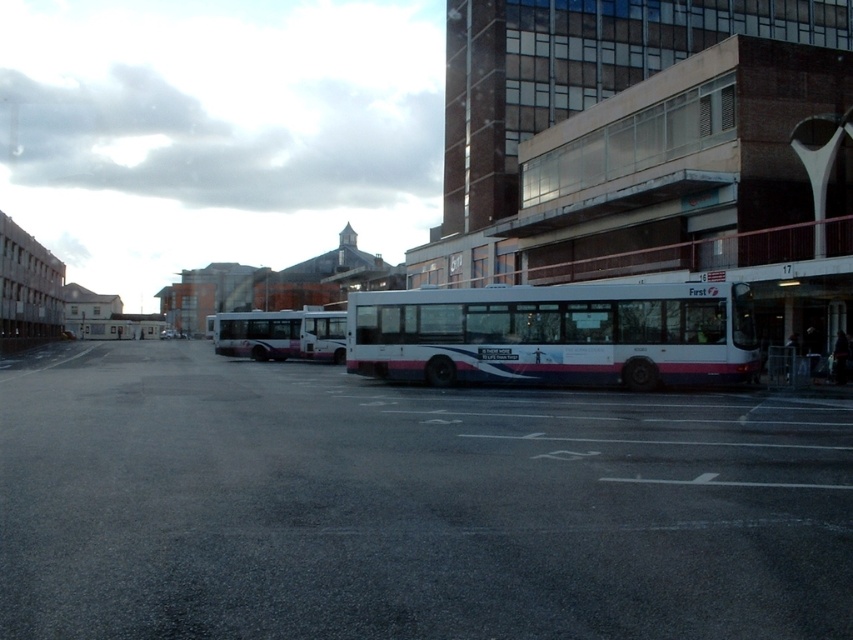
Question: Considering the relative positions of white matte bus at center and white glossy bus at center in the image provided, where is white matte bus at center located with respect to white glossy bus at center?

Choices:
 (A) left
 (B) right

Answer: (B)

Question: Is white matte bus at center to the left of white glossy bus at center from the viewer's perspective?

Choices:
 (A) yes
 (B) no

Answer: (B)

Question: Which point is farther to the camera?

Choices:
 (A) (230, 401)
 (B) (277, 339)
 (C) (503, 333)

Answer: (B)

Question: Among these points, which one is nearest to the camera?

Choices:
 (A) (712, 360)
 (B) (682, 397)
 (C) (270, 323)

Answer: (B)

Question: Is gray asphalt parking lot at center thinner than white glossy bus at center?

Choices:
 (A) no
 (B) yes

Answer: (A)

Question: Which is nearer to the white glossy bus at center?

Choices:
 (A) gray asphalt parking lot at center
 (B) white matte bus at center

Answer: (B)